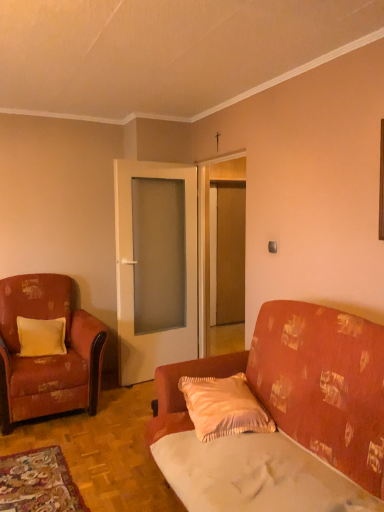
Question: Can you confirm if pink satin pillow at center, which ranks as the second pillow in left-to-right order, is wider than yellow satin pillow at left, the 1th pillow viewed from the left?

Choices:
 (A) no
 (B) yes

Answer: (B)

Question: From a real-world perspective, is pink satin pillow at center, which ranks as the first pillow in front-to-back order, on yellow satin pillow at left, which is counted as the first pillow, starting from the back?

Choices:
 (A) no
 (B) yes

Answer: (A)

Question: From the image's perspective, does pink satin pillow at center, the 2th pillow in the back-to-front sequence, appear higher than yellow satin pillow at left, which is counted as the first pillow, starting from the back?

Choices:
 (A) no
 (B) yes

Answer: (A)

Question: Is pink satin pillow at center, which ranks as the first pillow in front-to-back order, positioned beyond the bounds of yellow satin pillow at left, which ranks as the 2th pillow in right-to-left order?

Choices:
 (A) no
 (B) yes

Answer: (B)

Question: Is pink satin pillow at center, which ranks as the first pillow in front-to-back order, at the right side of yellow satin pillow at left, the 1th pillow viewed from the left?

Choices:
 (A) no
 (B) yes

Answer: (B)

Question: Is yellow satin pillow at left, the 1th pillow viewed from the left, a part of pink satin pillow at center, which ranks as the second pillow in left-to-right order?

Choices:
 (A) yes
 (B) no

Answer: (B)

Question: Is yellow satin pillow at left, which ranks as the 2th pillow in right-to-left order, looking in the opposite direction of white fabric sheet at lower right?

Choices:
 (A) no
 (B) yes

Answer: (A)

Question: From a real-world perspective, is yellow satin pillow at left, which is counted as the first pillow, starting from the back, under white fabric sheet at lower right?

Choices:
 (A) yes
 (B) no

Answer: (B)

Question: Does yellow satin pillow at left, which ranks as the 2th pillow in right-to-left order, have a greater height compared to white fabric sheet at lower right?

Choices:
 (A) yes
 (B) no

Answer: (A)

Question: Is yellow satin pillow at left, which ranks as the 2th pillow in front-to-back order, at the left side of white fabric sheet at lower right?

Choices:
 (A) no
 (B) yes

Answer: (B)

Question: Is yellow satin pillow at left, which ranks as the 2th pillow in front-to-back order, outside white fabric sheet at lower right?

Choices:
 (A) yes
 (B) no

Answer: (A)

Question: Is yellow satin pillow at left, the 1th pillow viewed from the left, positioned before white fabric sheet at lower right?

Choices:
 (A) yes
 (B) no

Answer: (B)

Question: Can distressed fabric armchair at left be found inside pink satin pillow at center, which ranks as the first pillow in front-to-back order?

Choices:
 (A) no
 (B) yes

Answer: (A)